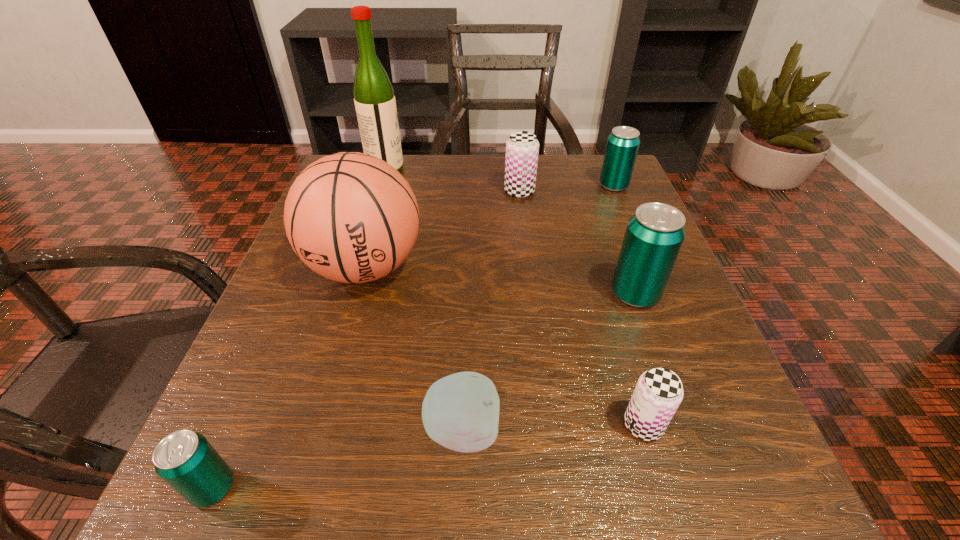
Where is `vacant area located 0.200m on the back of the apple`? vacant area located 0.200m on the back of the apple is located at coordinates click(467, 295).

What are the coordinates of `free spot located 0.130m on the left of the right purple beer can` in the screenshot? It's located at (525, 425).

What are the coordinates of `free location located 0.090m on the right of the leftmost beer can` in the screenshot? It's located at (310, 488).

Find the location of a particular element. liquor positioned at the far edge is located at coordinates (374, 99).

You are a GUI agent. You are given a task and a screenshot of the screen. Output one action in this format:
    pyautogui.click(x=<x>, y=<y>)
    Task: Click on the apple located at the near edge
    The image size is (960, 540).
    Given the screenshot: What is the action you would take?
    pyautogui.click(x=460, y=412)

Locate an element on the screen. beer can situated at the near edge is located at coordinates (185, 460).

Where is `liquor that is at the left edge`? This screenshot has width=960, height=540. liquor that is at the left edge is located at coordinates (374, 99).

At what (x,y) coordinates should I click in order to perform the action: click on basketball at the left edge. Please return your answer as a coordinate pair (x, y). Looking at the image, I should click on (351, 217).

I want to click on beer can that is at the left edge, so click(x=185, y=460).

Image resolution: width=960 pixels, height=540 pixels. I want to click on object located at the far left corner, so click(x=374, y=99).